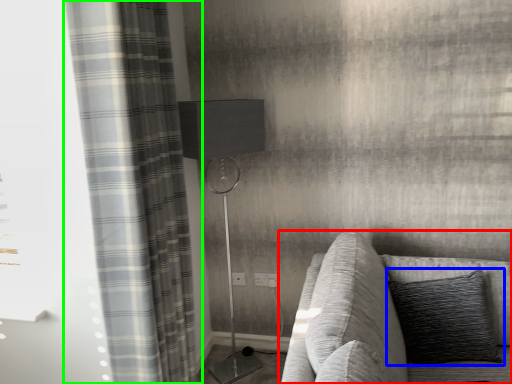
Question: Considering the real-world distances, which object is farthest from studio couch (highlighted by a red box)? pillow (highlighted by a blue box) or curtain (highlighted by a green box)?

Choices:
 (A) pillow
 (B) curtain

Answer: (B)